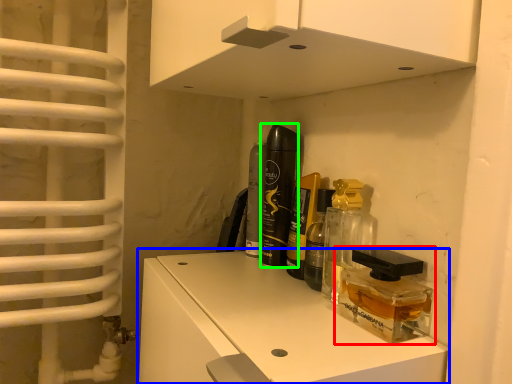
Question: Based on their relative distances, which object is farther from product (highlighted by a red box)? Choose from cabinetry (highlighted by a blue box) and perfume (highlighted by a green box).

Choices:
 (A) cabinetry
 (B) perfume

Answer: (B)